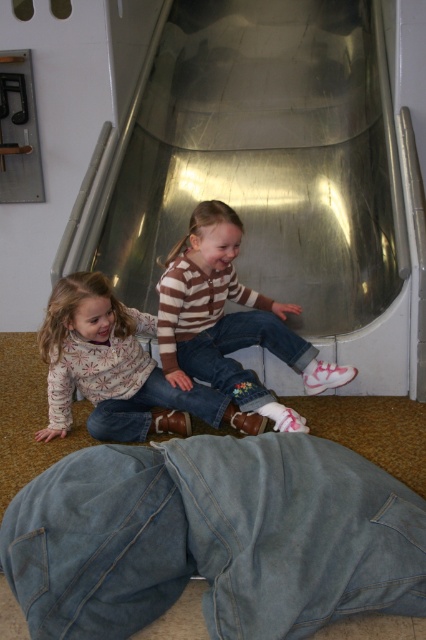
Question: Can you confirm if metallic silver escalator at center is positioned to the left of striped sweater at center?

Choices:
 (A) yes
 (B) no

Answer: (B)

Question: Is the position of metallic silver escalator at center more distant than that of floral-patterned sweater at lower left?

Choices:
 (A) no
 (B) yes

Answer: (B)

Question: Which of these objects is positioned farthest from the floral-patterned sweater at lower left?

Choices:
 (A) metallic silver escalator at center
 (B) striped sweater at center
 (C) denim pants at lower center

Answer: (A)

Question: Which point is farther to the camera?

Choices:
 (A) floral-patterned sweater at lower left
 (B) metallic silver escalator at center
 (C) striped sweater at center
 (D) denim pants at lower center

Answer: (B)

Question: Which point appears farthest from the camera in this image?

Choices:
 (A) (173, 442)
 (B) (376, 346)

Answer: (B)

Question: Can you confirm if metallic silver escalator at center is bigger than floral-patterned sweater at lower left?

Choices:
 (A) yes
 (B) no

Answer: (A)